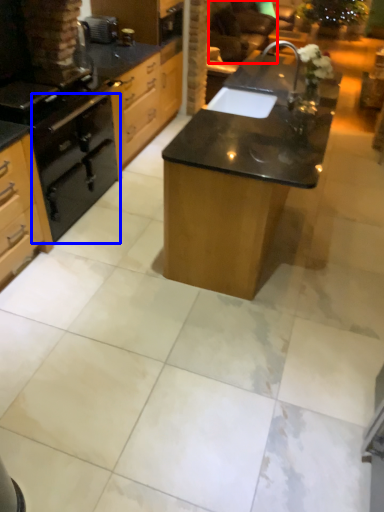
Question: Which object is further to the camera taking this photo, armchair (highlighted by a red box) or oven (highlighted by a blue box)?

Choices:
 (A) armchair
 (B) oven

Answer: (A)